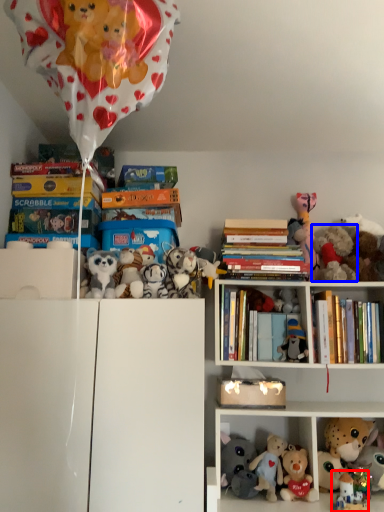
Question: Among these objects, which one is nearest to the camera, toy (highlighted by a red box) or toy (highlighted by a blue box)?

Choices:
 (A) toy
 (B) toy

Answer: (A)